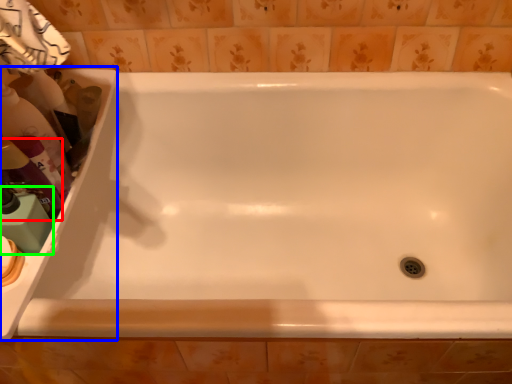
Question: Which is farther away from cleaning product (highlighted by a red box)? sink (highlighted by a blue box) or cleaning product (highlighted by a green box)?

Choices:
 (A) sink
 (B) cleaning product

Answer: (A)